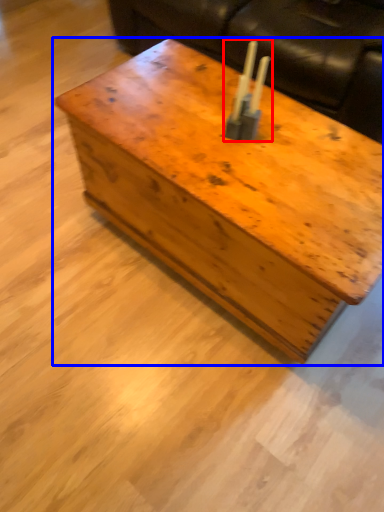
Question: Which object appears closest to the camera in this image, candle holder (highlighted by a red box) or table (highlighted by a blue box)?

Choices:
 (A) candle holder
 (B) table

Answer: (B)